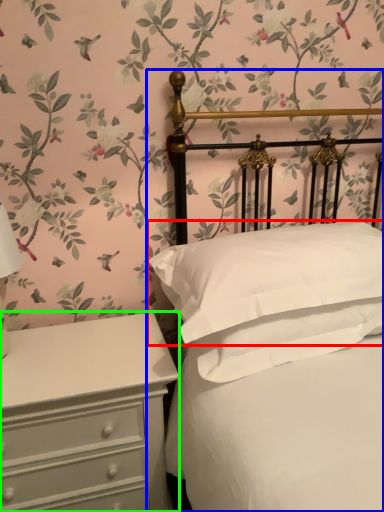
Question: Considering the real-world distances, which object is farthest from pillow (highlighted by a red box)? bed (highlighted by a blue box) or chest of drawers (highlighted by a green box)?

Choices:
 (A) bed
 (B) chest of drawers

Answer: (B)